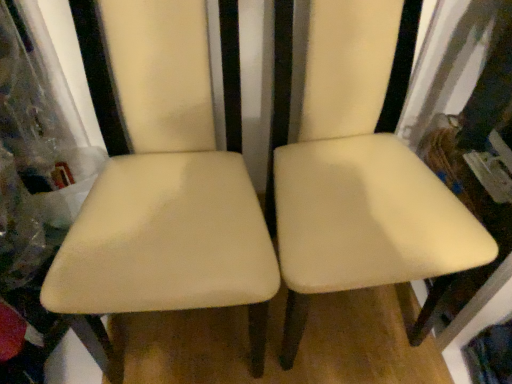
Question: Can you confirm if beige leather chair at center, positioned as the 2th chair in right-to-left order, is shorter than matte cream chair at center, the 2th chair when ordered from left to right?

Choices:
 (A) no
 (B) yes

Answer: (B)

Question: Is beige leather chair at center, positioned as the 2th chair in right-to-left order, closer to camera compared to matte cream chair at center, the 2th chair when ordered from left to right?

Choices:
 (A) yes
 (B) no

Answer: (A)

Question: From a real-world perspective, is beige leather chair at center, the 1th chair in the left-to-right sequence, under matte cream chair at center, the 2th chair when ordered from left to right?

Choices:
 (A) yes
 (B) no

Answer: (B)

Question: Is beige leather chair at center, the 1th chair in the left-to-right sequence, placed right next to matte cream chair at center, the 2th chair when ordered from left to right?

Choices:
 (A) no
 (B) yes

Answer: (A)

Question: Considering the relative sizes of beige leather chair at center, positioned as the 2th chair in right-to-left order, and matte cream chair at center, which appears as the first chair when viewed from the right, in the image provided, is beige leather chair at center, positioned as the 2th chair in right-to-left order, bigger than matte cream chair at center, which appears as the first chair when viewed from the right,?

Choices:
 (A) yes
 (B) no

Answer: (B)

Question: Can you confirm if beige leather chair at center, positioned as the 2th chair in right-to-left order, is positioned to the right of matte cream chair at center, which appears as the first chair when viewed from the right?

Choices:
 (A) no
 (B) yes

Answer: (A)

Question: Considering the relative sizes of matte cream chair at center, which appears as the first chair when viewed from the right, and beige leather chair at center, the 1th chair in the left-to-right sequence, in the image provided, is matte cream chair at center, which appears as the first chair when viewed from the right, bigger than beige leather chair at center, the 1th chair in the left-to-right sequence,?

Choices:
 (A) yes
 (B) no

Answer: (A)

Question: From the image's perspective, is matte cream chair at center, which appears as the first chair when viewed from the right, under beige leather chair at center, the 1th chair in the left-to-right sequence?

Choices:
 (A) no
 (B) yes

Answer: (A)

Question: Is matte cream chair at center, the 2th chair when ordered from left to right, positioned behind beige leather chair at center, the 1th chair in the left-to-right sequence?

Choices:
 (A) no
 (B) yes

Answer: (B)

Question: Does matte cream chair at center, the 2th chair when ordered from left to right, have a greater height compared to beige leather chair at center, positioned as the 2th chair in right-to-left order?

Choices:
 (A) no
 (B) yes

Answer: (B)

Question: Is matte cream chair at center, which appears as the first chair when viewed from the right, in contact with beige leather chair at center, positioned as the 2th chair in right-to-left order?

Choices:
 (A) no
 (B) yes

Answer: (A)

Question: Is matte cream chair at center, the 2th chair when ordered from left to right, not within beige leather chair at center, positioned as the 2th chair in right-to-left order?

Choices:
 (A) yes
 (B) no

Answer: (A)

Question: Would you say matte cream chair at center, the 2th chair when ordered from left to right, is inside or outside beige leather chair at center, positioned as the 2th chair in right-to-left order?

Choices:
 (A) outside
 (B) inside

Answer: (A)